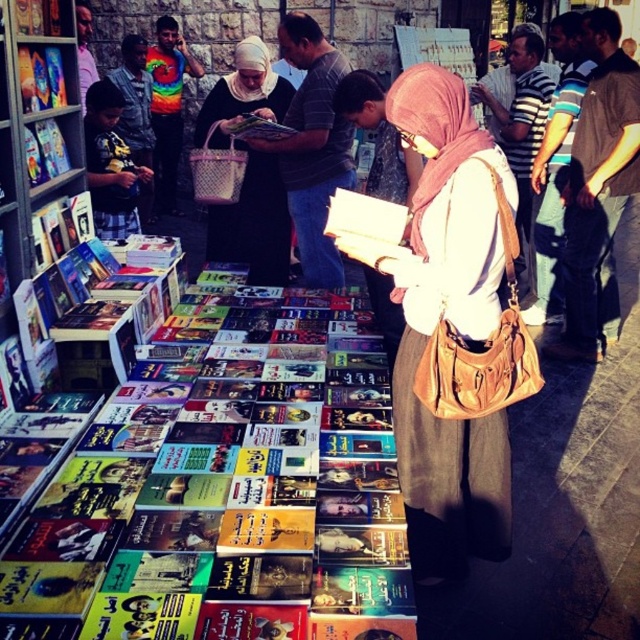
Which of these two, matte beige scarf at center or matte black dress at center, stands taller?

With more height is matte beige scarf at center.

Is matte beige scarf at center below matte black dress at center?

Indeed, matte beige scarf at center is positioned under matte black dress at center.

Is point (387, 252) positioned after point (209, 125)?

No.

Identify the location of matte beige scarf at center. (449, 323).

Who is taller, hardcover book at center or matte black dress at center?

matte black dress at center is taller.

Measure the distance between hardcover book at center and camera.

hardcover book at center and camera are 5.06 feet apart.

This screenshot has height=640, width=640. I want to click on hardcover book at center, so click(x=218, y=493).

Who is higher up, matte black shirt at center or matte black book at center?

matte black book at center

Can you confirm if matte black shirt at center is taller than matte black book at center?

A: Yes.

Does point (301, 212) come closer to viewer compared to point (285, 125)?

No, (301, 212) is behind (285, 125).

Locate an element on the screen. Image resolution: width=640 pixels, height=640 pixels. matte black shirt at center is located at coordinates [x=312, y=147].